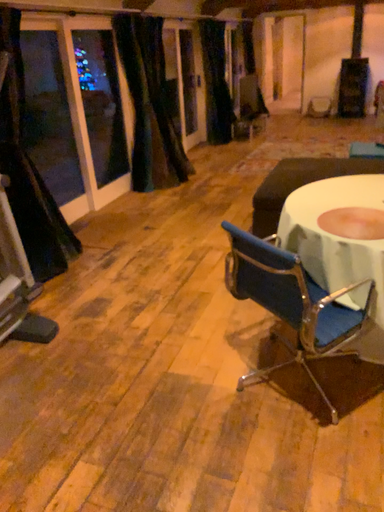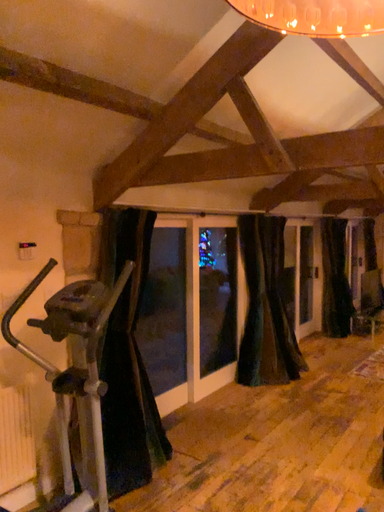
Question: How did the camera likely rotate when shooting the video?

Choices:
 (A) rotated upward
 (B) rotated downward

Answer: (A)